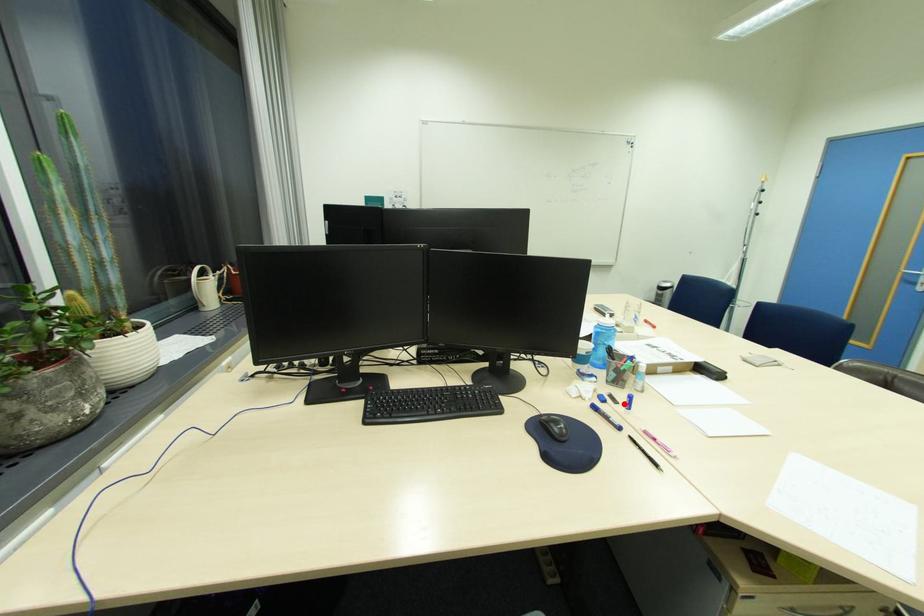
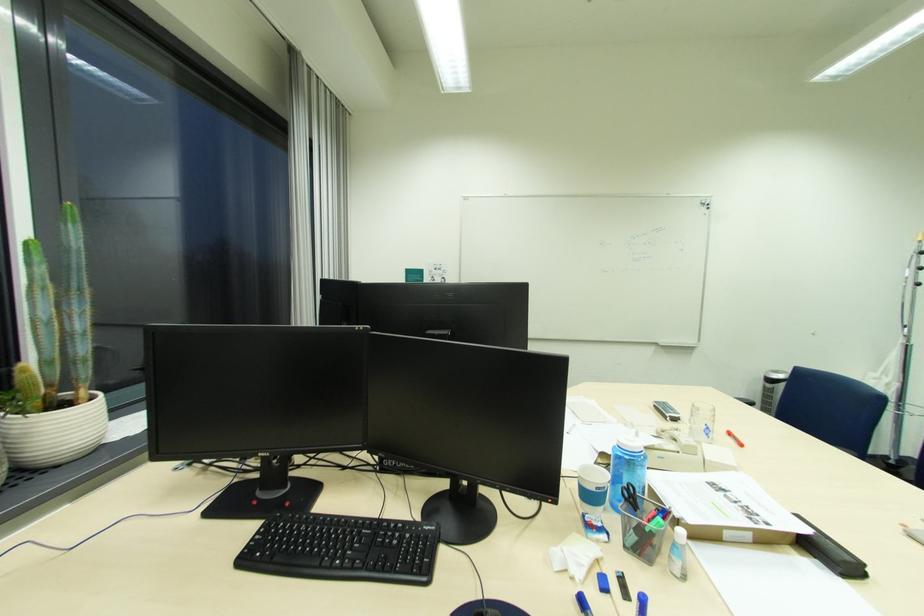
Where in the second image is the point corresponding to the highlighted location from the first image?

(636, 601)